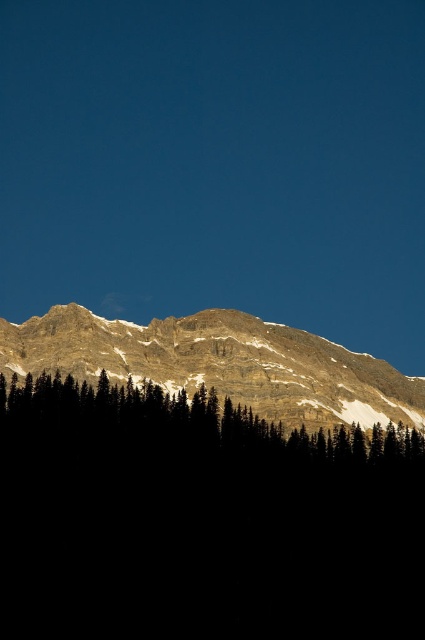
Identify the location of rocky brown mountain range at upper center. The image size is (425, 640). (221, 364).

Can you confirm if green textured trees at lower center is wider than green textured trees at center?

No, green textured trees at lower center is not wider than green textured trees at center.

Can you confirm if green textured trees at lower center is smaller than green textured trees at center?

No.

The height and width of the screenshot is (640, 425). Describe the element at coordinates (201, 520) in the screenshot. I see `green textured trees at lower center` at that location.

Find the location of a particular element. green textured trees at lower center is located at coordinates (201, 520).

Between green textured trees at lower center and rocky brown mountain range at upper center, which one appears on the left side from the viewer's perspective?

green textured trees at lower center is more to the left.

Between green textured trees at lower center and rocky brown mountain range at upper center, which one is positioned lower?

Positioned lower is green textured trees at lower center.

Between point (113, 630) and point (368, 376), which one is positioned behind?

The point (368, 376) is behind.

At what (x,y) coordinates should I click in order to perform the action: click on green textured trees at lower center. Please return your answer as a coordinate pair (x, y). Image resolution: width=425 pixels, height=640 pixels. Looking at the image, I should click on (201, 520).